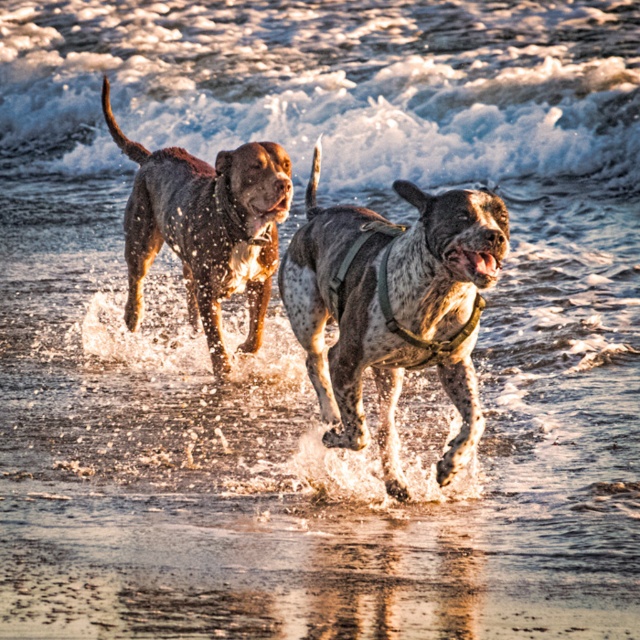
You are standing at the shoreline and want to throw a ball to one of the two points marked in the image. Which point, point (x=468, y=328) or point (x=180, y=180), is closer to you?

Point (x=468, y=328) is closer to the viewer than point (x=180, y=180), so you should throw the ball to point (x=468, y=328).

You are a photographer trying to capture the sunset with both the white textured foam at upper center and the shiny brown dog at center in your shot. Based on their positions, which object should you focus on first to ensure both are in frame?

The white textured foam at upper center is to the left of the shiny brown dog at center, so you should focus on the shiny brown dog at center first to ensure both are in frame.

You are a photographer trying to capture a sunset shot of the two dogs running on the beach. You notice the white textured foam at upper center and the shiny brown dog at center. Which object should you focus on if you want to include both in your frame without cropping either?

The white textured foam at upper center is larger in size compared to the shiny brown dog at center, so you should focus on the white textured foam at upper center to ensure both fit in the frame without cropping.